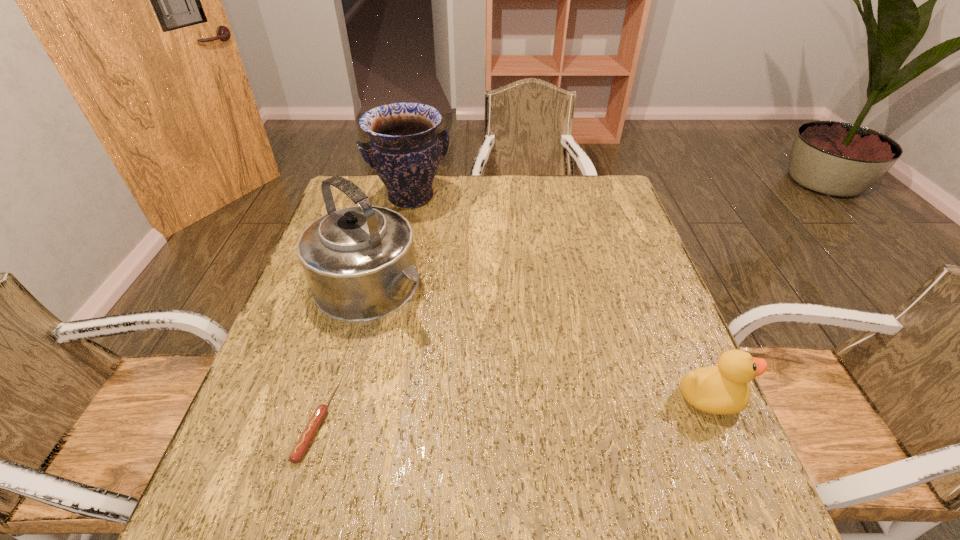
Identify the location of free space located 0.320m with the spout at the front of the second farthest object. click(x=514, y=390).

Where is `vacant region located with the spout at the front of the second farthest object`? vacant region located with the spout at the front of the second farthest object is located at coordinates (533, 405).

Locate an element on the screen. object that is at the far edge is located at coordinates (404, 150).

Where is `object located in the near edge section of the desktop`? object located in the near edge section of the desktop is located at coordinates (310, 430).

Find the location of `sausage located in the left edge section of the desktop`. sausage located in the left edge section of the desktop is located at coordinates (310, 430).

What are the coordinates of `pottery present at the left edge` in the screenshot? It's located at (404, 150).

Where is `kettle present at the left edge`? This screenshot has height=540, width=960. kettle present at the left edge is located at coordinates (359, 261).

Identify the location of object present at the right edge. (723, 389).

Locate an element on the screen. This screenshot has width=960, height=540. object present at the far left corner is located at coordinates (404, 150).

Locate an element on the screen. object located at the near left corner is located at coordinates point(310,430).